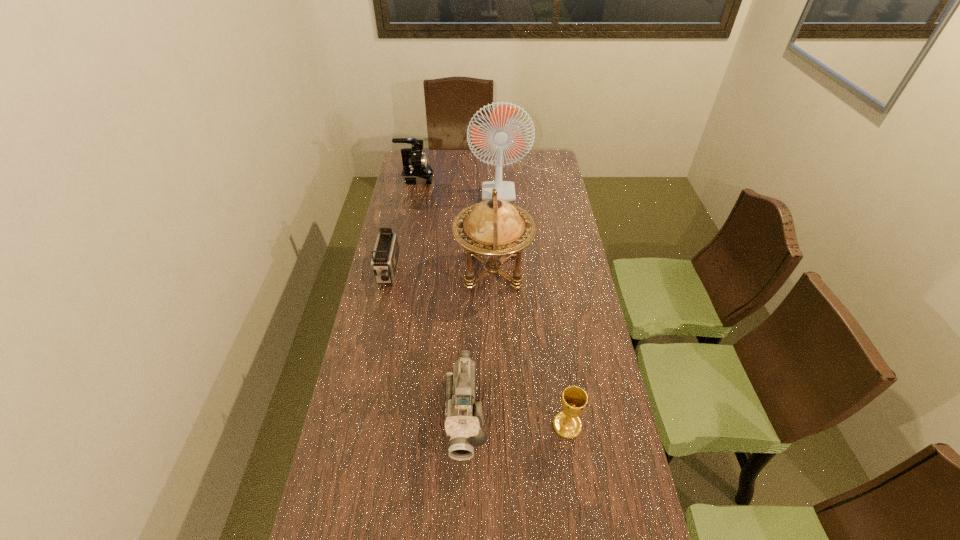
Where is `the tallest object`? The height and width of the screenshot is (540, 960). the tallest object is located at coordinates (500, 134).

The height and width of the screenshot is (540, 960). What are the coordinates of `globe` in the screenshot? It's located at (494, 227).

In order to click on the farthest camcorder in this screenshot , I will do click(416, 170).

The width and height of the screenshot is (960, 540). I want to click on the rightmost camcorder, so click(463, 421).

Where is `the second farthest camcorder`? the second farthest camcorder is located at coordinates (385, 257).

Identify the location of chalice. The height and width of the screenshot is (540, 960). (574, 400).

At what (x,y) coordinates should I click in order to perform the action: click on vacant space situated on the front-facing side of the fan. Please return your answer as a coordinate pair (x, y). The width and height of the screenshot is (960, 540). Looking at the image, I should click on (516, 213).

Locate an element on the screen. Image resolution: width=960 pixels, height=540 pixels. free region located 0.270m on the front-facing side of the globe is located at coordinates [x=385, y=271].

This screenshot has height=540, width=960. In order to click on vacant space situated on the front-facing side of the globe in this screenshot , I will do `click(426, 271)`.

Find the location of `free space located on the front-facing side of the globe`. free space located on the front-facing side of the globe is located at coordinates (414, 271).